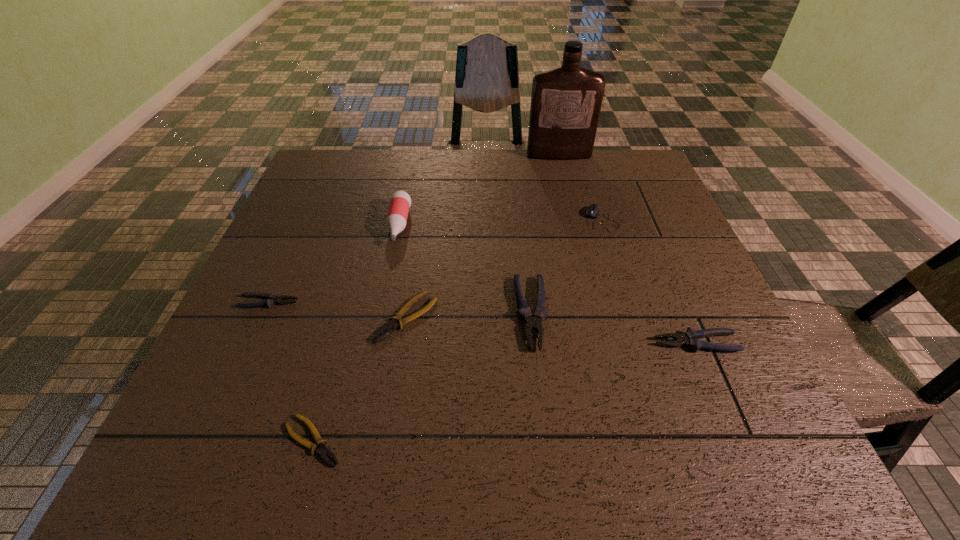
The image size is (960, 540). In order to click on vacant area that lies between the liquor and the farther yellow pliers in this screenshot , I will do `click(483, 237)`.

What are the coordinates of `free spot between the fourth pliers from left to right and the seventh shortest object` in the screenshot? It's located at (465, 269).

The height and width of the screenshot is (540, 960). I want to click on vacant space that's between the second gray pliers from left to right and the third tallest pliers, so click(400, 308).

At what (x,y) coordinates should I click in order to perform the action: click on free space between the shortest object and the smallest gray pliers. Please return your answer as a coordinate pair (x, y). This screenshot has height=540, width=960. Looking at the image, I should click on (291, 372).

Find the location of a particular element. The height and width of the screenshot is (540, 960). object identified as the closest to the second smallest gray pliers is located at coordinates point(532,323).

Locate an element on the screen. This screenshot has width=960, height=540. object that is the fifth closest to the pink bottle is located at coordinates (322, 451).

Identify which pliers is the fourth nearest to the second pliers from right to left. Please provide its 2D coordinates. Your answer should be formatted as a tuple, i.e. [(x, y)], where the tuple contains the x and y coordinates of a point satisfying the conditions above.

[(271, 299)]

Identify which pliers is the nearest to the leftmost gray pliers. Please provide its 2D coordinates. Your answer should be formatted as a tuple, i.e. [(x, y)], where the tuple contains the x and y coordinates of a point satisfying the conditions above.

[(387, 329)]

Find the location of a particular element. The height and width of the screenshot is (540, 960). gray pliers identified as the third closest to the nearest pliers is located at coordinates (690, 338).

Find the location of a particular element. Image resolution: width=960 pixels, height=540 pixels. gray pliers that is the third closest to the shortest pliers is located at coordinates (690, 338).